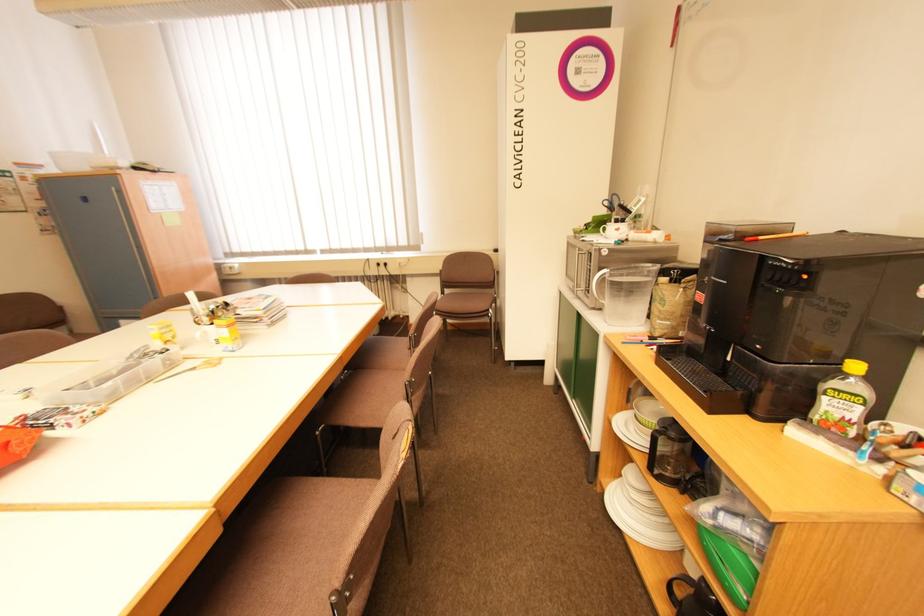
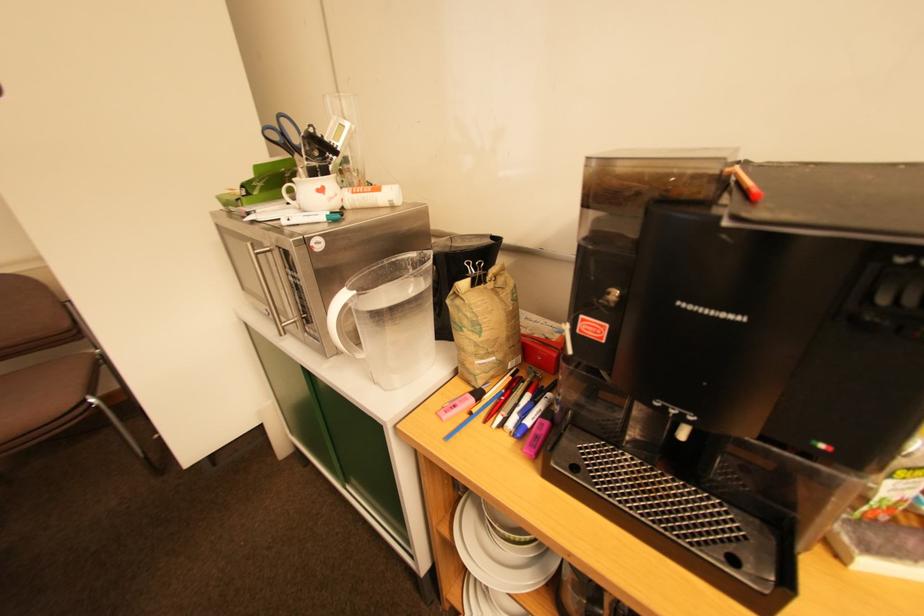
Question: The camera is either moving clockwise (left) or counter-clockwise (right) around the object. The first image is from the beginning of the video and the second image is from the end. Is the camera moving left or right when shooting the video?

Choices:
 (A) Left
 (B) Right

Answer: (A)